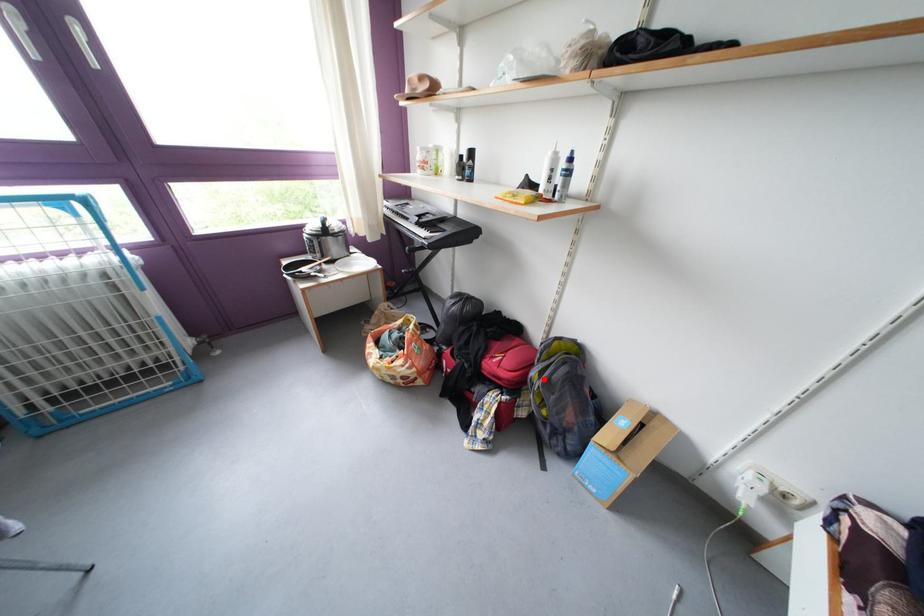
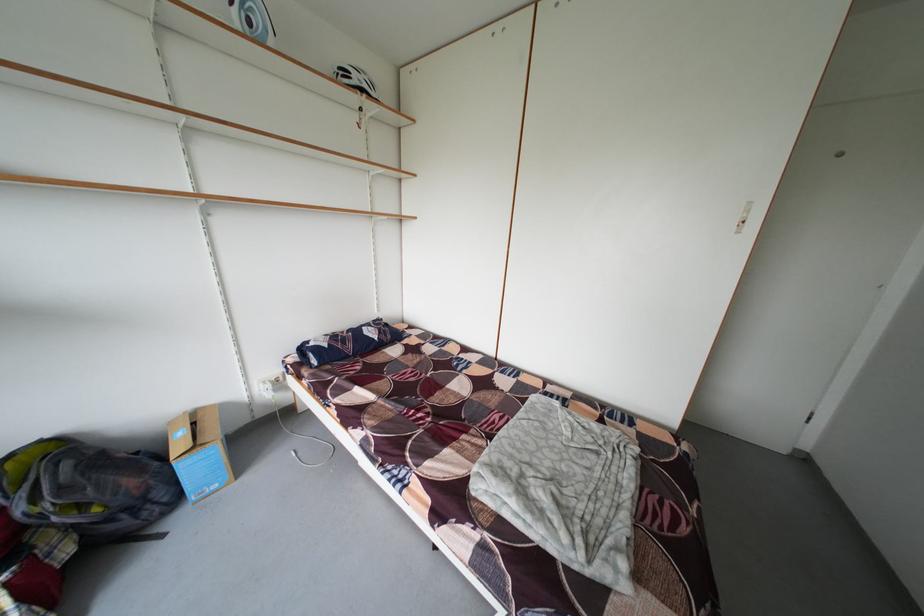
Question: I am providing you with two images of the same scene from different viewpoints. Image1 has a red point marked. In image2, the corresponding 3D location appears at what relative position? Reply with the corresponding letter.

Choices:
 (A) Closer
 (B) Farther

Answer: (A)